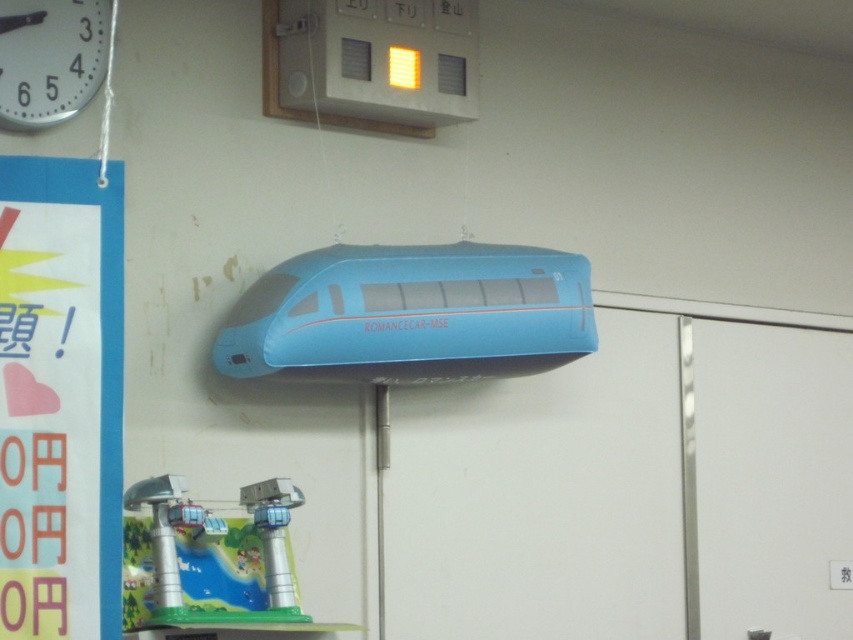
What are the coordinates of the blue matte train at center?

The blue matte train at center is located at point (410, 314).

You are standing in front of the blue matte train at center and want to read the text on the blue cardboard sign at left. Is the sign positioned above or below the train?

The blue cardboard sign at left is located below the blue matte train at center.

You are standing in a museum and see the ROMANCECAR MSE model train and the blue cardboard sign at left. You want to take a photo of both objects. Which object should you focus on first to ensure both are in frame?

You should focus on the ROMANCECAR MSE model train first because it is closer to you than the blue cardboard sign at left, which is 3.53 meters away. By focusing on the closer object, both will be in focus.